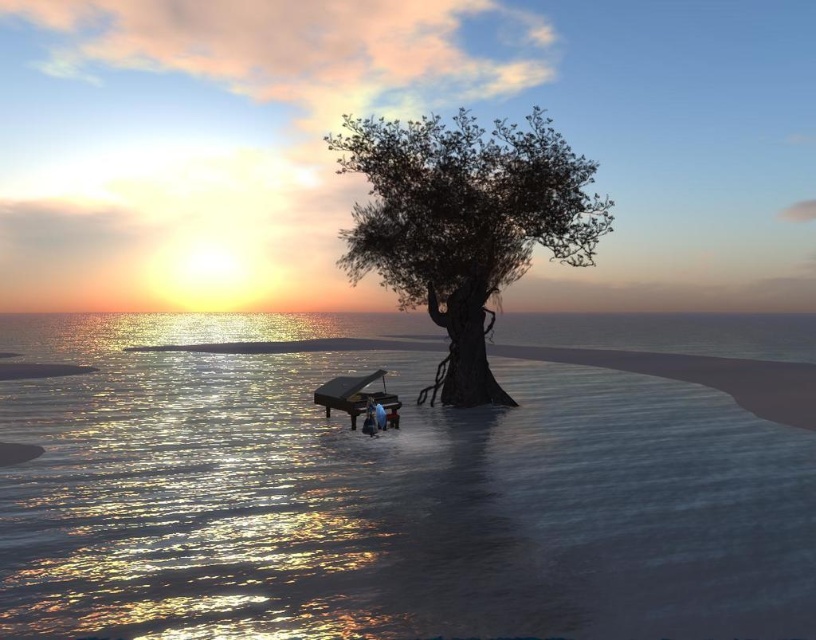
Question: Is shiny reflective water at center smaller than matte blue person at center?

Choices:
 (A) no
 (B) yes

Answer: (A)

Question: Does green matte tree at center have a smaller size compared to matte blue person at center?

Choices:
 (A) yes
 (B) no

Answer: (B)

Question: Which is farther from the green matte tree at center?

Choices:
 (A) matte blue person at center
 (B) shiny reflective water at center

Answer: (B)

Question: Among these objects, which one is nearest to the camera?

Choices:
 (A) matte blue person at center
 (B) green matte tree at center

Answer: (A)

Question: Among these objects, which one is farthest from the camera?

Choices:
 (A) shiny reflective water at center
 (B) matte blue person at center
 (C) green matte tree at center

Answer: (C)

Question: Observing the image, what is the correct spatial positioning of green matte tree at center in reference to matte blue person at center?

Choices:
 (A) below
 (B) above

Answer: (B)